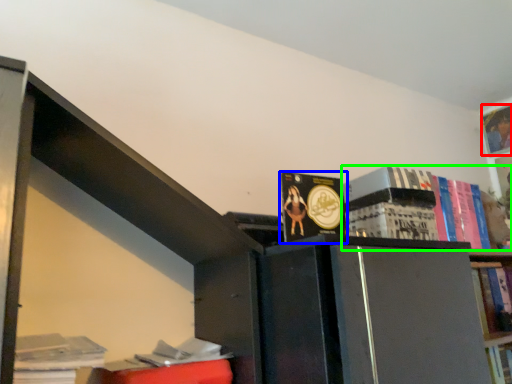
Question: Which is nearer to the book (highlighted by a red box)? book (highlighted by a blue box) or book (highlighted by a green box).

Choices:
 (A) book
 (B) book

Answer: (B)